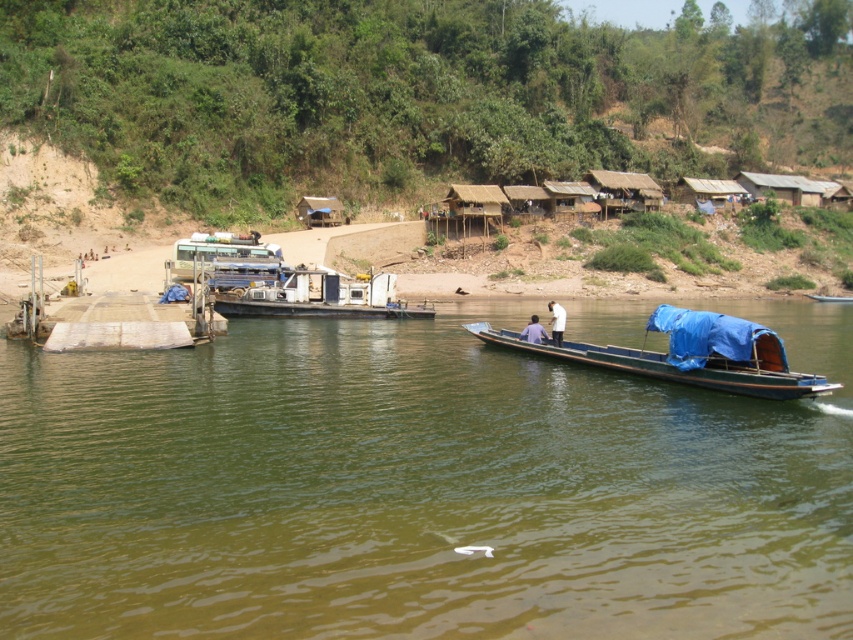
Can you confirm if green matte water at center is positioned to the left of blue fabric boat at center?

Indeed, green matte water at center is positioned on the left side of blue fabric boat at center.

Which is behind, point (705, 413) or point (538, 330)?

Positioned behind is point (538, 330).

Where is `green matte water at center`? This screenshot has height=640, width=853. green matte water at center is located at coordinates (419, 488).

Is point (570, 342) farther from camera compared to point (554, 305)?

Yes.

This screenshot has width=853, height=640. I want to click on blue tarpaulin boat at lower right, so click(x=677, y=368).

Does blue tarpaulin boat at lower right have a larger size compared to wooden planks dock at left?

Yes.

What do you see at coordinates (677, 368) in the screenshot? I see `blue tarpaulin boat at lower right` at bounding box center [677, 368].

Which is in front, point (503, 342) or point (96, 330)?

Point (96, 330) is more forward.

The height and width of the screenshot is (640, 853). I want to click on blue tarpaulin boat at lower right, so click(x=677, y=368).